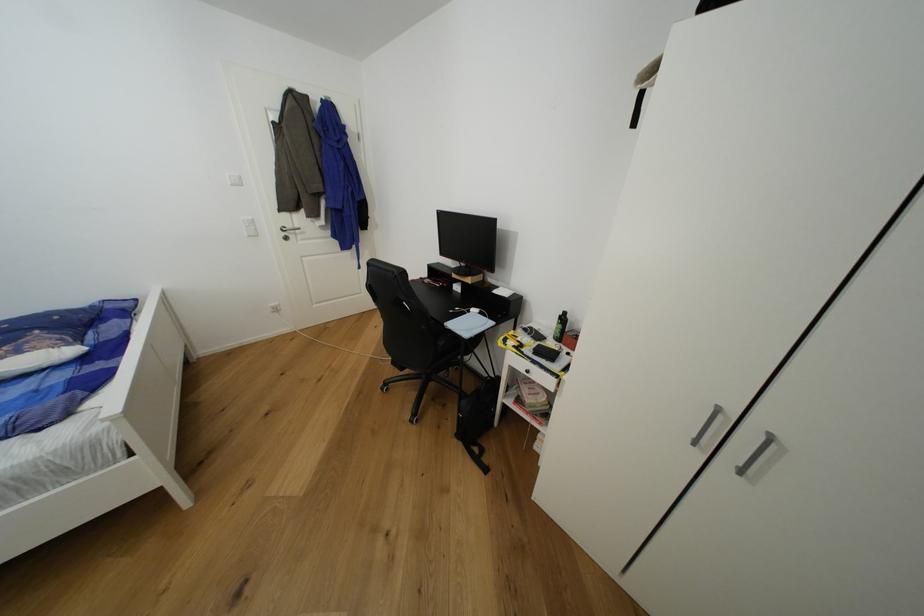
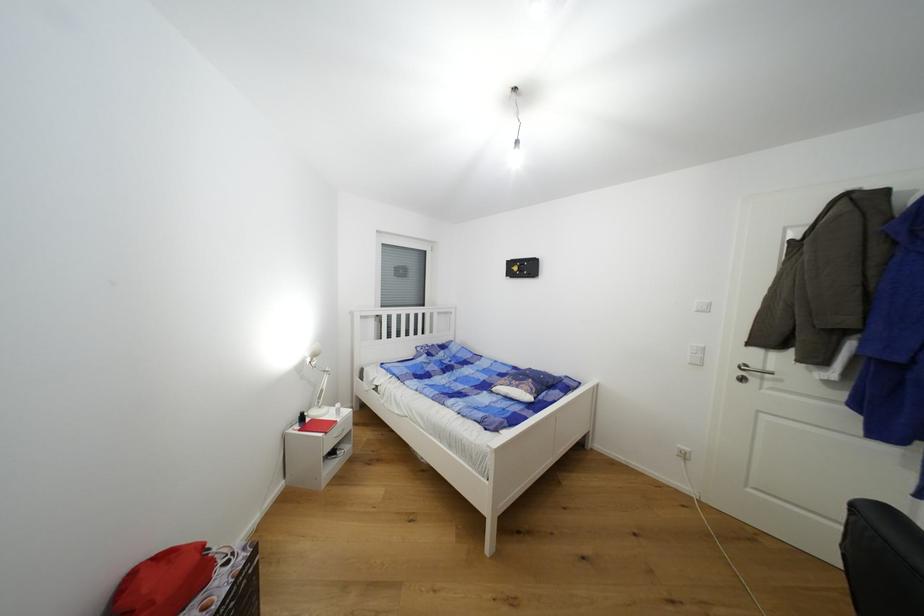
Question: The first image is from the beginning of the video and the second image is from the end. How did the camera likely rotate when shooting the video?

Choices:
 (A) Left
 (B) Right
 (C) Up
 (D) Down

Answer: (A)